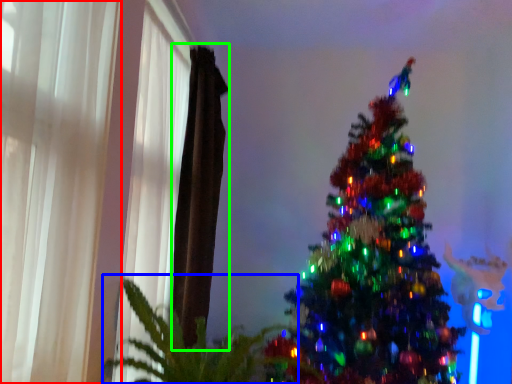
Question: Which is farther away from curtain (highlighted by a red box)? plant (highlighted by a blue box) or curtain (highlighted by a green box)?

Choices:
 (A) plant
 (B) curtain

Answer: (B)